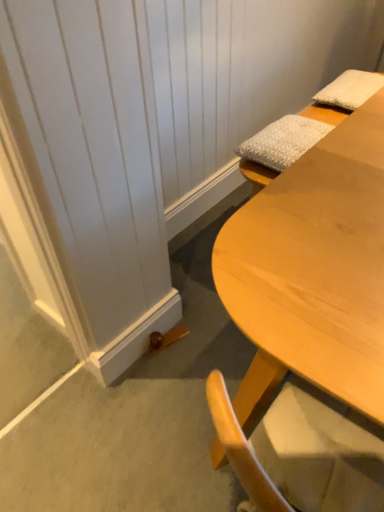
Question: Is the depth of white textured pillow at upper right, which is the 2th pillow from right to left, less than that of white textured pillow at upper right, positioned as the 2th pillow in front-to-back order?

Choices:
 (A) no
 (B) yes

Answer: (B)

Question: From the image's perspective, would you say white textured pillow at upper right, which is the 2th pillow from right to left, is positioned over white textured pillow at upper right, acting as the 1th pillow starting from the back?

Choices:
 (A) yes
 (B) no

Answer: (B)

Question: Can white textured pillow at upper right, acting as the 1th pillow starting from the back, be found inside white textured pillow at upper right, which is the 2th pillow from right to left?

Choices:
 (A) yes
 (B) no

Answer: (B)

Question: Is white textured pillow at upper right, the first pillow positioned from the left, smaller than white textured pillow at upper right, arranged as the second pillow when ordered from the bottom?

Choices:
 (A) yes
 (B) no

Answer: (A)

Question: Can you confirm if white textured pillow at upper right, the second pillow when ordered from back to front, is thinner than white textured pillow at upper right, positioned as the first pillow in right-to-left order?

Choices:
 (A) yes
 (B) no

Answer: (A)

Question: Considering the positions of white textured pillow at upper right, the 1th pillow when ordered from bottom to top, and light wood desk at lower right in the image, is white textured pillow at upper right, the 1th pillow when ordered from bottom to top, bigger or smaller than light wood desk at lower right?

Choices:
 (A) big
 (B) small

Answer: (B)

Question: Considering the relative positions of white textured pillow at upper right, the first pillow in the front-to-back sequence, and light wood desk at lower right in the image provided, is white textured pillow at upper right, the first pillow in the front-to-back sequence, to the left or to the right of light wood desk at lower right?

Choices:
 (A) right
 (B) left

Answer: (A)

Question: Considering the positions of white textured pillow at upper right, which is the second pillow in top-to-bottom order, and light wood desk at lower right in the image, is white textured pillow at upper right, which is the second pillow in top-to-bottom order, taller or shorter than light wood desk at lower right?

Choices:
 (A) tall
 (B) short

Answer: (B)

Question: Is white textured pillow at upper right, which is the second pillow in top-to-bottom order, spatially inside light wood desk at lower right, or outside of it?

Choices:
 (A) inside
 (B) outside

Answer: (B)

Question: In terms of height, does white textured pillow at upper right, positioned as the 2th pillow in front-to-back order, look taller or shorter compared to white textured pillow at upper right, which is the second pillow in top-to-bottom order?

Choices:
 (A) short
 (B) tall

Answer: (B)

Question: Considering the positions of white textured pillow at upper right, positioned as the 2th pillow in front-to-back order, and white textured pillow at upper right, the first pillow positioned from the left, in the image, is white textured pillow at upper right, positioned as the 2th pillow in front-to-back order, bigger or smaller than white textured pillow at upper right, the first pillow positioned from the left,?

Choices:
 (A) small
 (B) big

Answer: (B)

Question: In the image, is white textured pillow at upper right, the second pillow in the left-to-right sequence, positioned in front of or behind white textured pillow at upper right, the first pillow positioned from the left?

Choices:
 (A) behind
 (B) front

Answer: (A)

Question: From the image's perspective, is white textured pillow at upper right, the first pillow from the top, above or below white textured pillow at upper right, the second pillow when ordered from back to front?

Choices:
 (A) below
 (B) above

Answer: (B)

Question: Visually, is white textured pillow at upper right, the first pillow in the front-to-back sequence, positioned to the left or to the right of white textured pillow at upper right, positioned as the first pillow in right-to-left order?

Choices:
 (A) right
 (B) left

Answer: (B)

Question: From a real-world perspective, is white textured pillow at upper right, the second pillow when ordered from back to front, above or below white textured pillow at upper right, the second pillow in the left-to-right sequence?

Choices:
 (A) above
 (B) below

Answer: (B)